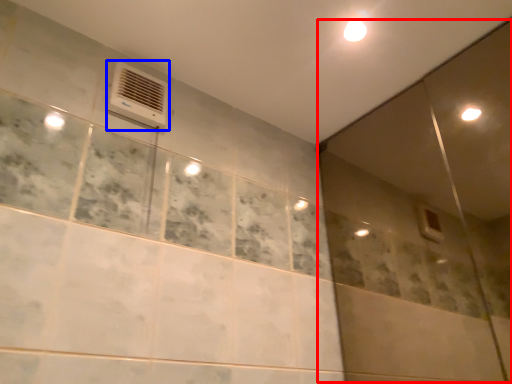
Question: Which object appears farthest to the camera in this image, screen door (highlighted by a red box) or air conditioning (highlighted by a blue box)?

Choices:
 (A) screen door
 (B) air conditioning

Answer: (B)